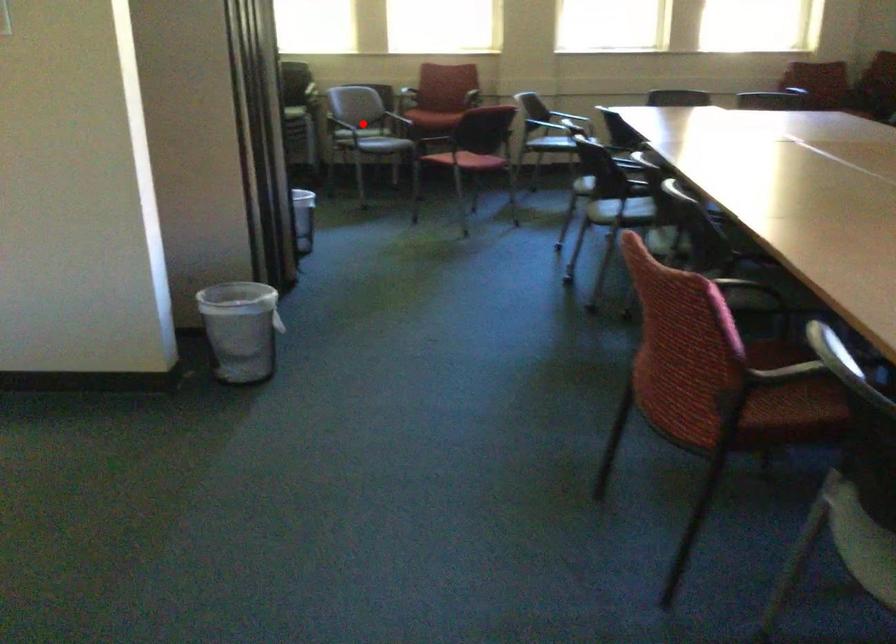
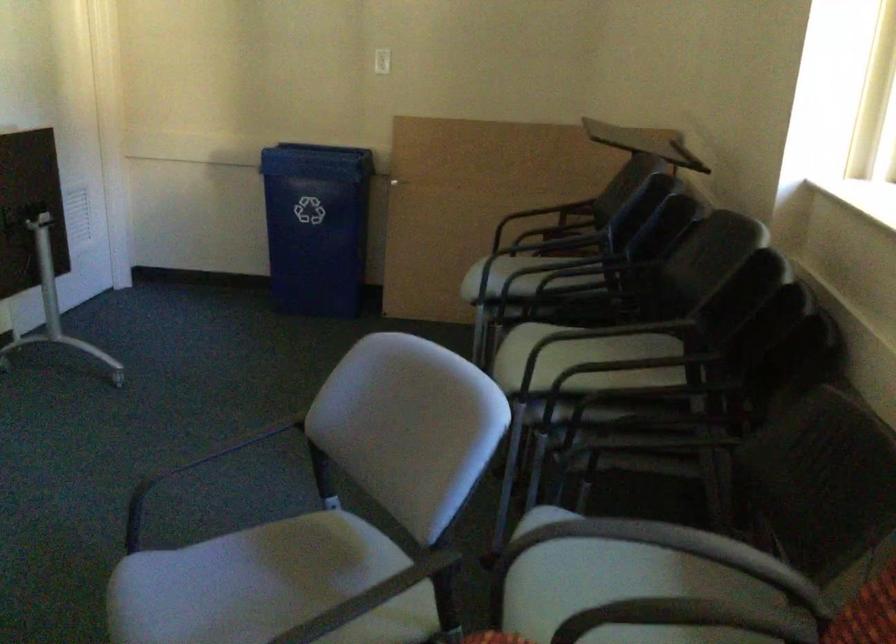
Question: I am providing you with two images of the same scene from different viewpoints. Image1 has a red point marked. In image2, the corresponding 3D location appears at what relative position? Reply with the corresponding letter.

Choices:
 (A) Closer
 (B) Farther

Answer: (A)